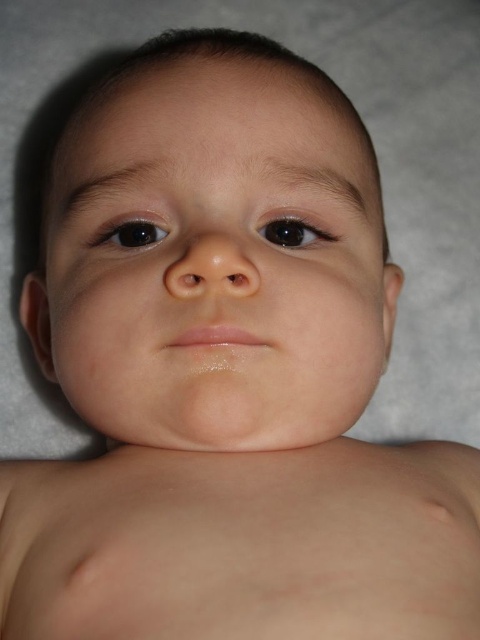
You are a photographer adjusting the lighting for a baby photo shoot. You notice the baby has a smooth skin face at center and a black glossy eye at upper left. Which object should you focus on to ensure proper lighting for the baby?

Answer: The smooth skin face at center is to the right of the black glossy eye at upper left, so you should focus on the smooth skin face at center to ensure proper lighting for the baby.

Consider the image. You are a photographer adjusting the focus on a camera capturing the baby in the image. You notice two points of interest marked as point 1 at coordinates point (74, 220) and point 2 at coordinates point (115, 237). Since you want to focus on the point closer to the camera, which point should you choose?

Point 2 at coordinates point (115, 237) is closer to the camera than point 1 at coordinates point (74, 220), so you should focus on point 2 at coordinates point (115, 237).